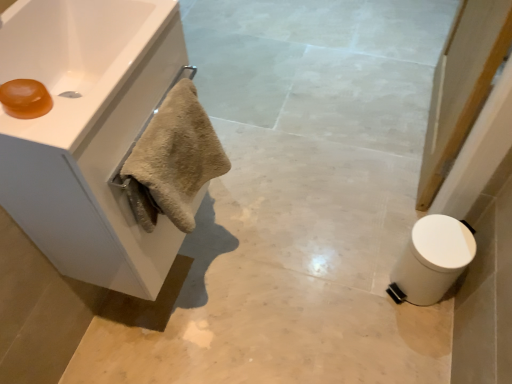
Identify the location of vacant space behind white matte trash can at lower right. (380, 235).